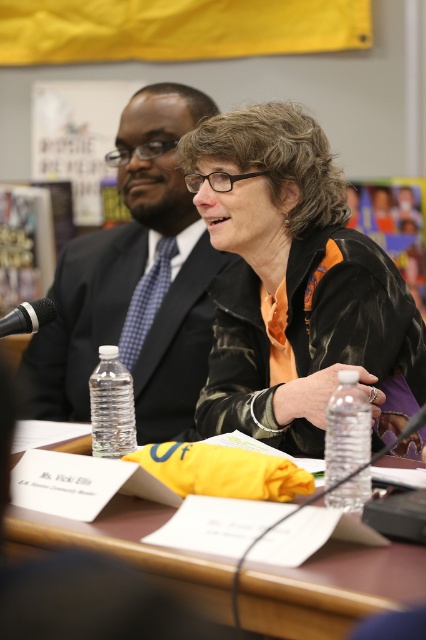
Question: Which object is the closest to the brown wooden table at center?

Choices:
 (A) matte black jacket at center
 (B) black metallic microphone at left
 (C) matte black suit at center

Answer: (B)

Question: Is brown wooden table at center positioned in front of black metallic microphone at left?

Choices:
 (A) no
 (B) yes

Answer: (B)

Question: Estimate the real-world distances between objects in this image. Which object is farther from the matte black suit at center?

Choices:
 (A) black metallic microphone at left
 (B) matte black jacket at center
 (C) brown wooden table at center

Answer: (C)

Question: Does matte black jacket at center appear over black metallic microphone at left?

Choices:
 (A) yes
 (B) no

Answer: (A)

Question: Among these points, which one is farthest from the camera?

Choices:
 (A) (250, 196)
 (B) (23, 304)
 (C) (149, 116)

Answer: (C)

Question: Is the position of matte black suit at center more distant than that of blue checkered tie at center?

Choices:
 (A) no
 (B) yes

Answer: (A)